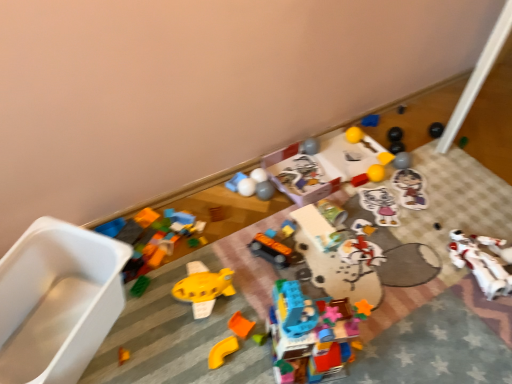
The image size is (512, 384). I want to click on free area in between matte plastic sticker at center, positioned as the 16th toy in left-to-right order, and translucent plastic building blocks at center, the 9th toy positioned from the left, so click(368, 252).